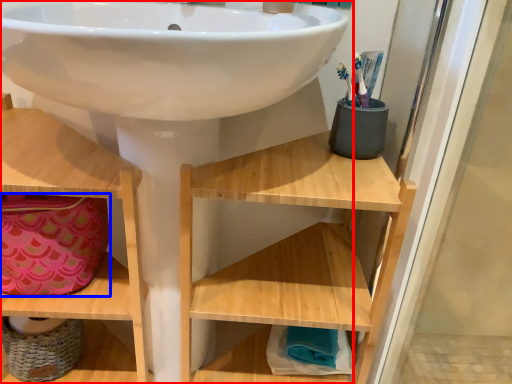
Question: Which point is further to the camera, sink (highlighted by a red box) or material (highlighted by a blue box)?

Choices:
 (A) sink
 (B) material

Answer: (B)